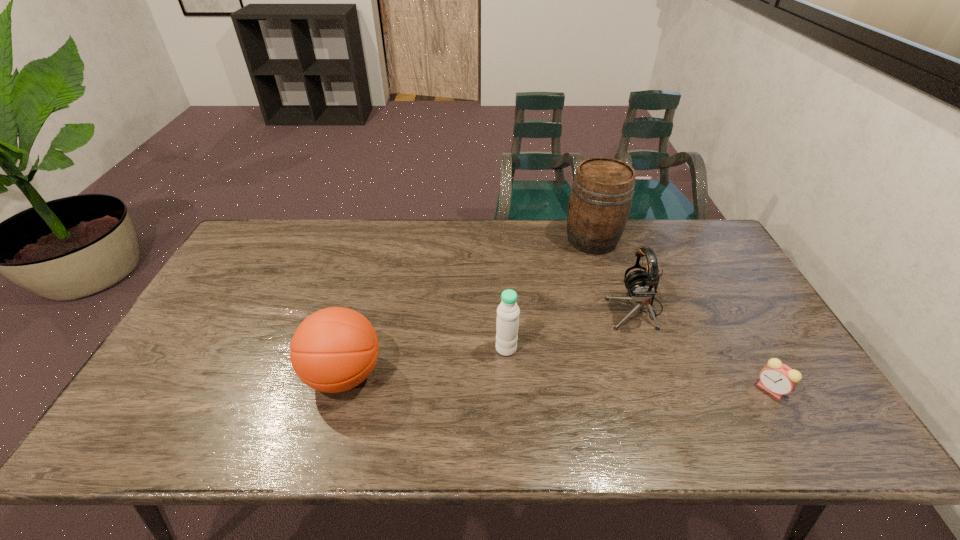
Where is `the tallest object`? Image resolution: width=960 pixels, height=540 pixels. the tallest object is located at coordinates (601, 196).

I want to click on cider, so click(601, 196).

This screenshot has width=960, height=540. Find the location of `earphone`. earphone is located at coordinates (642, 285).

Locate an element on the screen. water bottle is located at coordinates (507, 324).

Where is `basketball`? Image resolution: width=960 pixels, height=540 pixels. basketball is located at coordinates (335, 349).

Where is `the shortest object`? The height and width of the screenshot is (540, 960). the shortest object is located at coordinates (778, 379).

This screenshot has height=540, width=960. In order to click on alarm clock in this screenshot , I will do `click(778, 379)`.

The image size is (960, 540). I want to click on free location located on the side of the tallest object near the bung hole, so click(x=453, y=240).

At what (x,y) coordinates should I click in order to perform the action: click on vacant space located on the side of the tallest object near the bung hole. Please return your answer as a coordinate pair (x, y). The image size is (960, 540). Looking at the image, I should click on (479, 240).

Where is `free space located on the side of the tallest object near the bung hole`? free space located on the side of the tallest object near the bung hole is located at coordinates point(470,240).